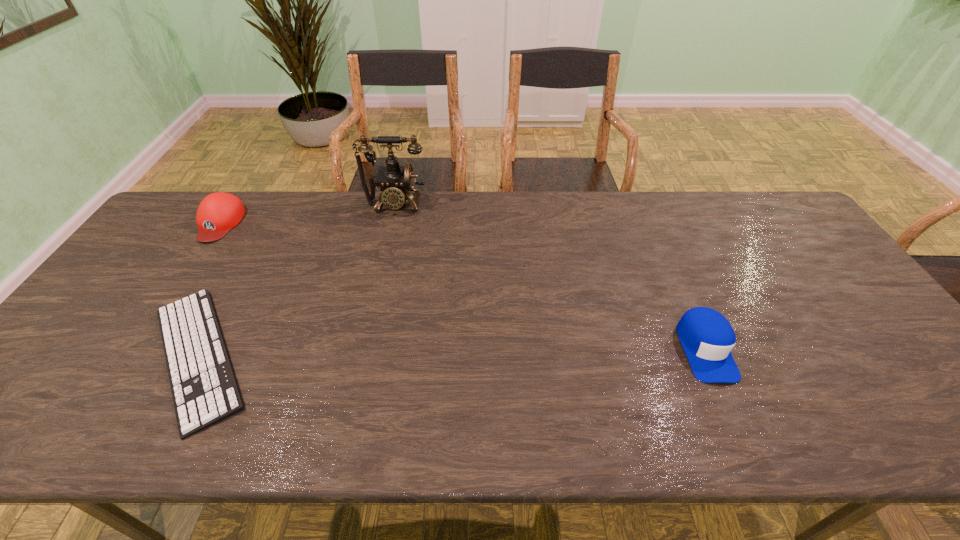
Select which object is the closest to the computer keyboard. Please provide its 2D coordinates. Your answer should be formatted as a tuple, i.e. [(x, y)], where the tuple contains the x and y coordinates of a point satisfying the conditions above.

[(219, 212)]

Identify the location of object that is the second closest to the computer keyboard. This screenshot has height=540, width=960. (395, 181).

Image resolution: width=960 pixels, height=540 pixels. Identify the location of vacant area in the image that satisfies the following two spatial constraints: 1. on the front-facing side of the farther baseball cap; 2. on the left side of the shortest object. (130, 356).

The image size is (960, 540). Identify the location of free spot that satisfies the following two spatial constraints: 1. on the front-facing side of the farther baseball cap; 2. on the left side of the computer keyboard. (130, 356).